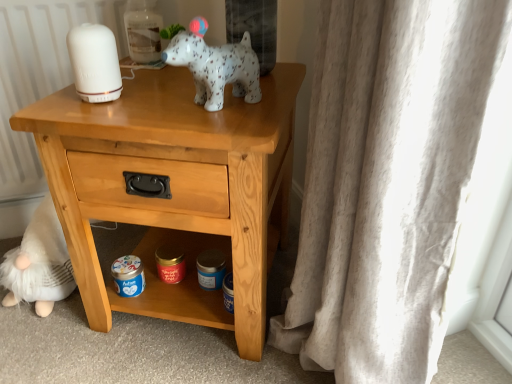
Question: Is light wood nightstand at center directly adjacent to white matte bottle at upper center?

Choices:
 (A) yes
 (B) no

Answer: (B)

Question: From the image's perspective, is light wood nightstand at center on top of white matte bottle at upper center?

Choices:
 (A) yes
 (B) no

Answer: (B)

Question: Is light wood nightstand at center shorter than white matte bottle at upper center?

Choices:
 (A) no
 (B) yes

Answer: (A)

Question: Is light wood nightstand at center looking in the opposite direction of white matte bottle at upper center?

Choices:
 (A) no
 (B) yes

Answer: (A)

Question: Is light wood nightstand at center taller than white matte bottle at upper center?

Choices:
 (A) no
 (B) yes

Answer: (B)

Question: From the image's perspective, does light wood nightstand at center appear lower than white matte bottle at upper center?

Choices:
 (A) no
 (B) yes

Answer: (B)

Question: Can you see white speckled ceramic dog at upper center touching white fluffy gnome at lower left?

Choices:
 (A) no
 (B) yes

Answer: (A)

Question: Is white speckled ceramic dog at upper center to the right of white fluffy gnome at lower left from the viewer's perspective?

Choices:
 (A) yes
 (B) no

Answer: (A)

Question: From a real-world perspective, does white speckled ceramic dog at upper center stand above white fluffy gnome at lower left?

Choices:
 (A) yes
 (B) no

Answer: (A)

Question: Considering the relative sizes of white speckled ceramic dog at upper center and white fluffy gnome at lower left in the image provided, is white speckled ceramic dog at upper center thinner than white fluffy gnome at lower left?

Choices:
 (A) no
 (B) yes

Answer: (B)

Question: Considering the relative sizes of white speckled ceramic dog at upper center and white fluffy gnome at lower left in the image provided, is white speckled ceramic dog at upper center wider than white fluffy gnome at lower left?

Choices:
 (A) no
 (B) yes

Answer: (A)

Question: Does white speckled ceramic dog at upper center have a larger size compared to white fluffy gnome at lower left?

Choices:
 (A) no
 (B) yes

Answer: (A)

Question: Is white fluffy gnome at lower left wider than white speckled ceramic dog at upper center?

Choices:
 (A) yes
 (B) no

Answer: (A)